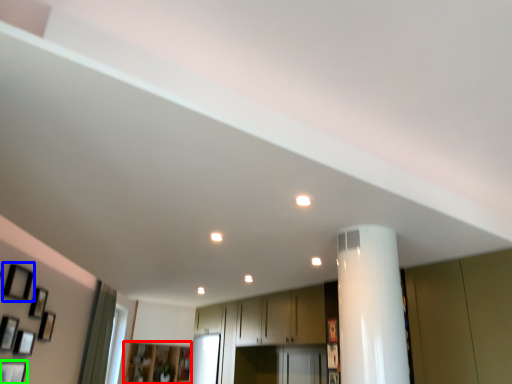
Question: Which object is positioned farthest from cabinetry (highlighted by a red box)? Select from picture frame (highlighted by a blue box) and picture frame (highlighted by a green box).

Choices:
 (A) picture frame
 (B) picture frame

Answer: (A)